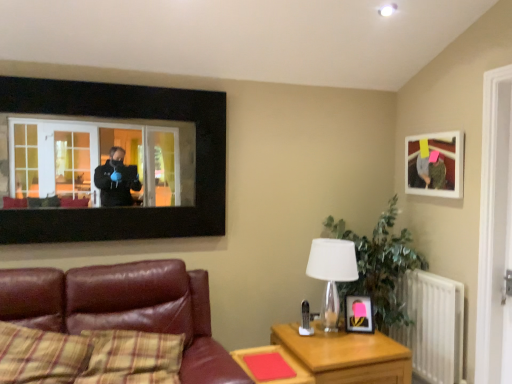
Locate an element on the screen. The width and height of the screenshot is (512, 384). white metallic radiator at right is located at coordinates coord(433,325).

This screenshot has width=512, height=384. Identify the location of white glass table lamp at center right. tap(332, 273).

Locate an element on the screen. This screenshot has height=384, width=512. matte black picture frame at center, the first picture frame viewed from the left is located at coordinates (359, 314).

Considering the relative sizes of black matte window frame at upper left and matte black picture frame at center, which appears as the 2th picture frame when viewed from the top, in the image provided, is black matte window frame at upper left shorter than matte black picture frame at center, which appears as the 2th picture frame when viewed from the top,?

Incorrect, the height of black matte window frame at upper left does not fall short of that of matte black picture frame at center, which appears as the 2th picture frame when viewed from the top.

Is black matte window frame at upper left far from matte black picture frame at center, which appears as the 2th picture frame when viewed from the top?

Indeed, black matte window frame at upper left is not near matte black picture frame at center, which appears as the 2th picture frame when viewed from the top.

In terms of size, does black matte window frame at upper left appear bigger or smaller than matte black picture frame at center, the first picture frame from the bottom?

Clearly, black matte window frame at upper left is larger in size than matte black picture frame at center, the first picture frame from the bottom.

Considering the sizes of matte black picture frame at center, marked as the 2th picture frame in a right-to-left arrangement, and green leafy plant at right in the image, is matte black picture frame at center, marked as the 2th picture frame in a right-to-left arrangement, wider or thinner than green leafy plant at right?

In the image, matte black picture frame at center, marked as the 2th picture frame in a right-to-left arrangement, appears to be more narrow than green leafy plant at right.

Considering the sizes of objects matte black picture frame at center, the first picture frame from the bottom, and green leafy plant at right in the image provided, who is bigger, matte black picture frame at center, the first picture frame from the bottom, or green leafy plant at right?

With larger size is green leafy plant at right.

From the image's perspective, is matte black picture frame at center, the first picture frame viewed from the left, under green leafy plant at right?

Yes.

Which is correct: matte black picture frame at center, which appears as the 2th picture frame when viewed from the top, is inside green leafy plant at right, or outside of it?

matte black picture frame at center, which appears as the 2th picture frame when viewed from the top, fits inside green leafy plant at right.

From a real-world perspective, relative to matte white picture frame at upper right, which ranks as the 1th picture frame in right-to-left order, is leather couch at lower left vertically above or below?

leather couch at lower left is situated lower than matte white picture frame at upper right, which ranks as the 1th picture frame in right-to-left order, in the real world.

Does leather couch at lower left appear on the right side of matte white picture frame at upper right, marked as the 1th picture frame in a top-to-bottom arrangement?

No.

Is there a large distance between leather couch at lower left and matte white picture frame at upper right, which is the second picture frame from left to right?

Indeed, leather couch at lower left is not near matte white picture frame at upper right, which is the second picture frame from left to right.

Considering the positions of objects leather couch at lower left and matte white picture frame at upper right, which ranks as the 1th picture frame in right-to-left order, in the image provided, who is behind, leather couch at lower left or matte white picture frame at upper right, which ranks as the 1th picture frame in right-to-left order,?

matte white picture frame at upper right, which ranks as the 1th picture frame in right-to-left order, is further from the camera.

Is green leafy plant at right situated inside white glass table lamp at center right or outside?

green leafy plant at right is located beyond the bounds of white glass table lamp at center right.

Can you tell me how much green leafy plant at right and white glass table lamp at center right differ in facing direction?

They differ by 1.32 degrees in their facing directions.

Is green leafy plant at right oriented towards white glass table lamp at center right?

No, green leafy plant at right is not facing towards white glass table lamp at center right.

Who is smaller, green leafy plant at right or white glass table lamp at center right?

Smaller between the two is white glass table lamp at center right.

Looking at their sizes, would you say white metallic radiator at right is wider or thinner than leather couch at lower left?

Considering their sizes, white metallic radiator at right looks slimmer than leather couch at lower left.

Would you say white metallic radiator at right is a long distance from leather couch at lower left?

white metallic radiator at right is positioned a significant distance from leather couch at lower left.

Who is smaller, white metallic radiator at right or leather couch at lower left?

With smaller size is white metallic radiator at right.

From the picture: Considering the relative sizes of leather couch at lower left and matte black picture frame at center, the first picture frame viewed from the left, in the image provided, is leather couch at lower left thinner than matte black picture frame at center, the first picture frame viewed from the left,?

Incorrect, the width of leather couch at lower left is not less than that of matte black picture frame at center, the first picture frame viewed from the left.

Is leather couch at lower left completely or partially outside of matte black picture frame at center, marked as the 2th picture frame in a right-to-left arrangement?

Yes, leather couch at lower left is not within matte black picture frame at center, marked as the 2th picture frame in a right-to-left arrangement.

Is leather couch at lower left bigger or smaller than matte black picture frame at center, the first picture frame viewed from the left?

In the image, leather couch at lower left appears to be larger than matte black picture frame at center, the first picture frame viewed from the left.

Considering the relative positions of leather couch at lower left and matte black picture frame at center, the first picture frame viewed from the left, in the image provided, is leather couch at lower left to the right of matte black picture frame at center, the first picture frame viewed from the left, from the viewer's perspective?

In fact, leather couch at lower left is to the left of matte black picture frame at center, the first picture frame viewed from the left.

From the image's perspective, is wooden table at lower center, which is the 2th table from right to left, located above green leafy plant at right?

No, from the image's perspective, wooden table at lower center, which is the 2th table from right to left, is not over green leafy plant at right.

Is wooden table at lower center, which is the 2th table from right to left, inside or outside of green leafy plant at right?

wooden table at lower center, which is the 2th table from right to left, cannot be found inside green leafy plant at right.

Which of these two, wooden table at lower center, which is the first table in left-to-right order, or green leafy plant at right, stands shorter?

wooden table at lower center, which is the first table in left-to-right order.

Considering the positions of points (239, 354) and (394, 278), is point (239, 354) closer to camera compared to point (394, 278)?

Yes.

Where is `the 1st picture frame counting from the right side of the black matte window frame at upper left`? the 1st picture frame counting from the right side of the black matte window frame at upper left is located at coordinates (359, 314).

Identify the location of houseplant in front of the matte black picture frame at center, the first picture frame viewed from the left. (379, 265).

When comparing their distances from leather couch at lower left, does black matte window frame at upper left or matte white picture frame at upper right, marked as the 1th picture frame in a top-to-bottom arrangement, seem further?

matte white picture frame at upper right, marked as the 1th picture frame in a top-to-bottom arrangement, is further to leather couch at lower left.

When comparing their distances from green leafy plant at right, does wooden table at lower center, which is the 2th table from right to left, or matte black picture frame at center, marked as the 2th picture frame in a right-to-left arrangement, seem closer?

matte black picture frame at center, marked as the 2th picture frame in a right-to-left arrangement, is closer to green leafy plant at right.

Estimate the real-world distances between objects in this image. Which object is closer to wooden table at lower right, which is the 2th table in left-to-right order, leather couch at lower left or white glass table lamp at center right?

Based on the image, white glass table lamp at center right appears to be nearer to wooden table at lower right, which is the 2th table in left-to-right order.

Considering their positions, is white glass table lamp at center right positioned further to leather couch at lower left than matte black picture frame at center, the first picture frame from the bottom?

Based on the image, matte black picture frame at center, the first picture frame from the bottom, appears to be further to leather couch at lower left.

When comparing their distances from wooden table at lower center, which is the 2th table from right to left, does green leafy plant at right or leather couch at lower left seem closer?

leather couch at lower left.

Which object lies further to the anchor point green leafy plant at right, matte white picture frame at upper right, which ranks as the 1th picture frame in right-to-left order, or white glass table lamp at center right?

matte white picture frame at upper right, which ranks as the 1th picture frame in right-to-left order, is further to green leafy plant at right.

Based on the photo, looking at the image, which one is located further to white metallic radiator at right, matte black picture frame at center, the first picture frame viewed from the left, or wooden table at lower right, which is the 2th table in left-to-right order?

wooden table at lower right, which is the 2th table in left-to-right order, lies further to white metallic radiator at right than the other object.

Considering their positions, is black matte window frame at upper left positioned further to white metallic radiator at right than wooden table at lower center, which is the 2th table from right to left?

Answer: black matte window frame at upper left is positioned further to the anchor white metallic radiator at right.

The width and height of the screenshot is (512, 384). I want to click on picture frame situated between black matte window frame at upper left and white metallic radiator at right from left to right, so click(x=359, y=314).

Locate an element on the screen. The width and height of the screenshot is (512, 384). houseplant situated between black matte window frame at upper left and white metallic radiator at right from left to right is located at coordinates (379, 265).

The height and width of the screenshot is (384, 512). In order to click on houseplant between matte white picture frame at upper right, acting as the second picture frame starting from the bottom, and matte black picture frame at center, the first picture frame from the bottom, from top to bottom in this screenshot , I will do `click(379, 265)`.

Where is `picture frame that lies between matte white picture frame at upper right, which is the second picture frame from left to right, and white metallic radiator at right from top to bottom`? Image resolution: width=512 pixels, height=384 pixels. picture frame that lies between matte white picture frame at upper right, which is the second picture frame from left to right, and white metallic radiator at right from top to bottom is located at coordinates (359, 314).